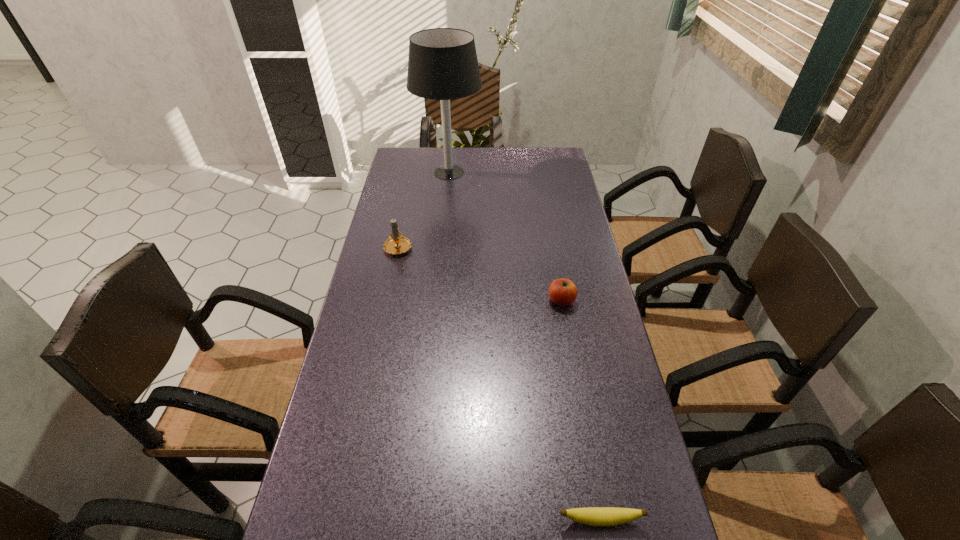
You are a GUI agent. You are given a task and a screenshot of the screen. Output one action in this format:
    pyautogui.click(x=<x>, y=<y>)
    Task: Click on the table lamp
    This screenshot has height=540, width=960.
    Given the screenshot: What is the action you would take?
    pyautogui.click(x=442, y=64)

The width and height of the screenshot is (960, 540). I want to click on the farthest object, so click(442, 64).

Image resolution: width=960 pixels, height=540 pixels. In order to click on candle in this screenshot , I will do `click(397, 244)`.

The width and height of the screenshot is (960, 540). Identify the location of the second farthest object. (397, 244).

Where is `the third farthest object`? The height and width of the screenshot is (540, 960). the third farthest object is located at coordinates (563, 292).

Locate an element on the screen. The image size is (960, 540). apple is located at coordinates pos(563,292).

Find the location of a particular element. The height and width of the screenshot is (540, 960). the shortest object is located at coordinates (594, 516).

You are a GUI agent. You are given a task and a screenshot of the screen. Output one action in this format:
    pyautogui.click(x=<x>, y=<y>)
    Task: Click on the nearest object
    The height and width of the screenshot is (540, 960).
    Given the screenshot: What is the action you would take?
    (x=594, y=516)

Identify the location of vacant point located 0.050m on the back of the farthest object. The height and width of the screenshot is (540, 960). (451, 150).

Where is `free space located 0.290m on the front of the third shortest object`? The width and height of the screenshot is (960, 540). free space located 0.290m on the front of the third shortest object is located at coordinates (382, 327).